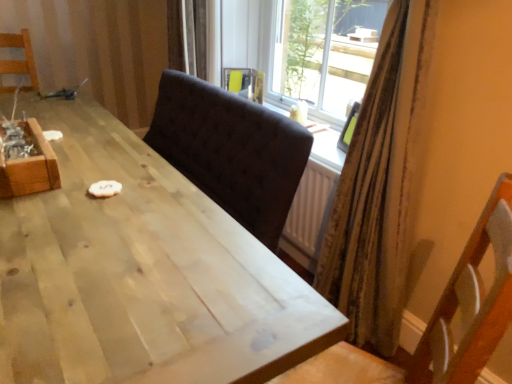
At what (x,y) coordinates should I click in order to perform the action: click on empty space that is ontop of light wood table at center. Please return your answer as a coordinate pair (x, y). The height and width of the screenshot is (384, 512). Looking at the image, I should click on (93, 207).